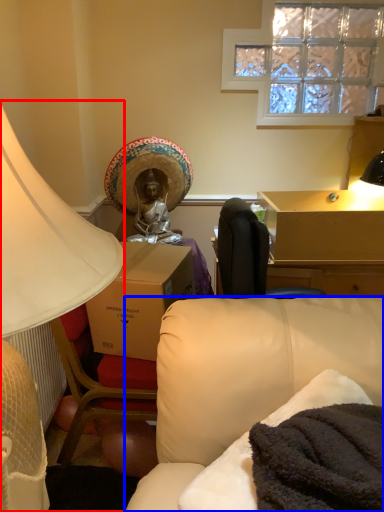
Question: Which of the following is the farthest to the observer, lamp (highlighted by a red box) or studio couch (highlighted by a blue box)?

Choices:
 (A) lamp
 (B) studio couch

Answer: (B)